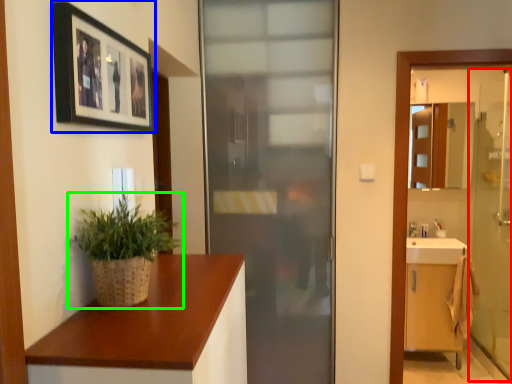
Question: Which is farther away from screen door (highlighted by a red box)? picture frame (highlighted by a blue box) or houseplant (highlighted by a green box)?

Choices:
 (A) picture frame
 (B) houseplant

Answer: (B)